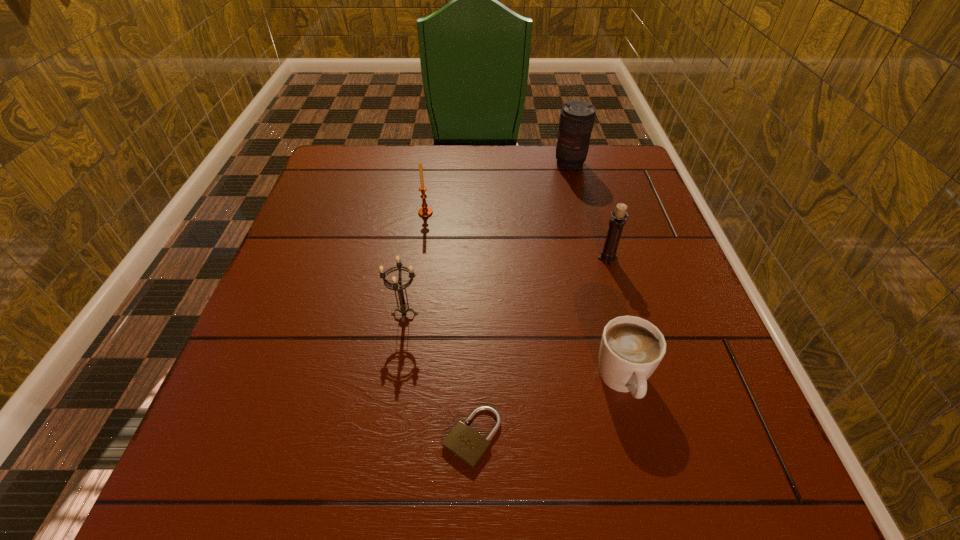
Identify the location of free space between the nearest candle holder and the second farthest object. The height and width of the screenshot is (540, 960). (415, 264).

Where is `free space between the third farthest object and the third nearest object`? The width and height of the screenshot is (960, 540). free space between the third farthest object and the third nearest object is located at coordinates (506, 286).

You are a GUI agent. You are given a task and a screenshot of the screen. Output one action in this format:
    pyautogui.click(x=<x>, y=<y>)
    Task: Click on the vacant area between the second farthest object and the third nearest object
    The width and height of the screenshot is (960, 540).
    Given the screenshot: What is the action you would take?
    pyautogui.click(x=415, y=264)

Identify the location of free space between the second farthest candle holder and the farthest object. (588, 211).

Locate an element on the screen. vacant space that is in between the fourth farthest object and the fourth object from right to left is located at coordinates (438, 376).

This screenshot has height=540, width=960. I want to click on object that is the nearest to the second farthest object, so (403, 308).

What are the coordinates of `object that stands as the second closest to the third nearest object` in the screenshot? It's located at (425, 211).

You are a GUI agent. You are given a task and a screenshot of the screen. Output one action in this format:
    pyautogui.click(x=<x>, y=<y>)
    Task: Click on the candle holder that is the third closest to the cappuccino
    This screenshot has width=960, height=540.
    Given the screenshot: What is the action you would take?
    pyautogui.click(x=425, y=211)

Identify which candle holder is the second closest to the second nearest candle holder. Please provide its 2D coordinates. Your answer should be formatted as a tuple, i.e. [(x, y)], where the tuple contains the x and y coordinates of a point satisfying the conditions above.

[(425, 211)]

At what (x,y) coordinates should I click in order to perform the action: click on vacant space that satisfies the following two spatial constraints: 1. on the back side of the third nearest object; 2. on the right side of the farthest candle holder. Please return your answer as a coordinate pair (x, y). The width and height of the screenshot is (960, 540). Looking at the image, I should click on (420, 213).